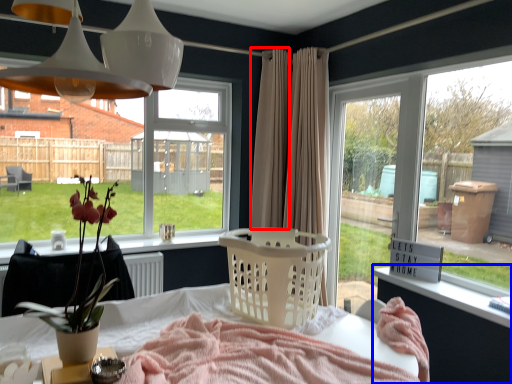
Question: Which object appears closest to the camera in this image, curtain (highlighted by a red box) or changing table (highlighted by a blue box)?

Choices:
 (A) curtain
 (B) changing table

Answer: (B)